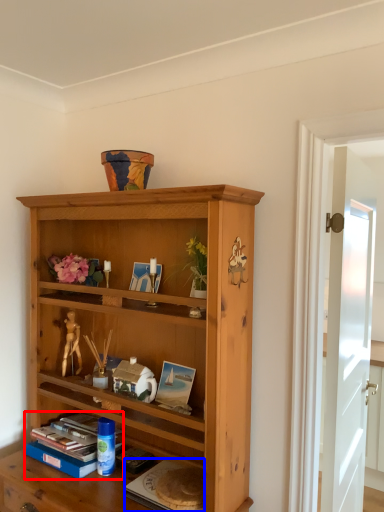
Question: Which object appears closest to the camera in this image, book (highlighted by a red box) or paperback book (highlighted by a blue box)?

Choices:
 (A) book
 (B) paperback book

Answer: (B)